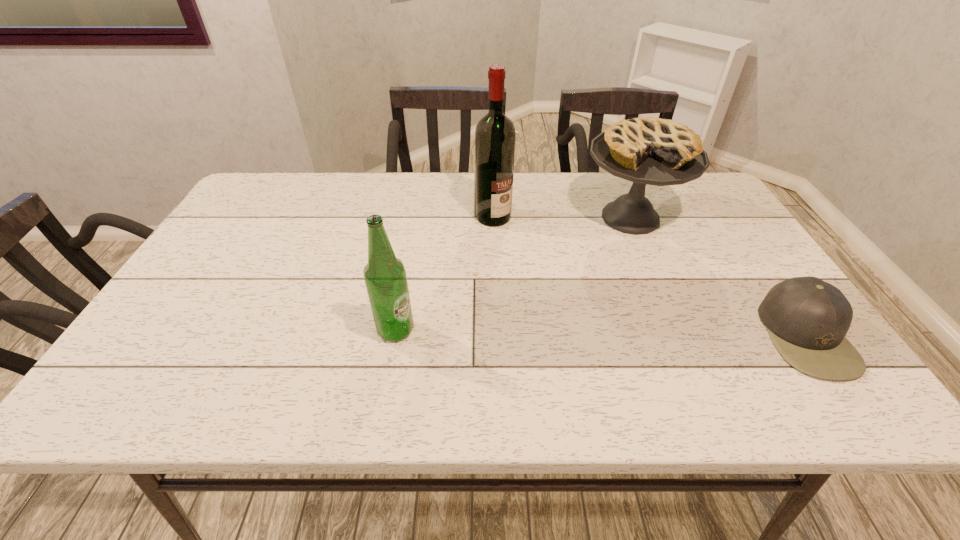
Find the location of `free spot on the desktop that is between the beer bottle and the rightmost object and is positioned on the cut side of the pie`. free spot on the desktop that is between the beer bottle and the rightmost object and is positioned on the cut side of the pie is located at coordinates pos(584,333).

Where is `vacant space on the desktop that is between the leftmost object and the rightmost object and is positioned on the front and back of the tallest object`? The width and height of the screenshot is (960, 540). vacant space on the desktop that is between the leftmost object and the rightmost object and is positioned on the front and back of the tallest object is located at coordinates (640, 333).